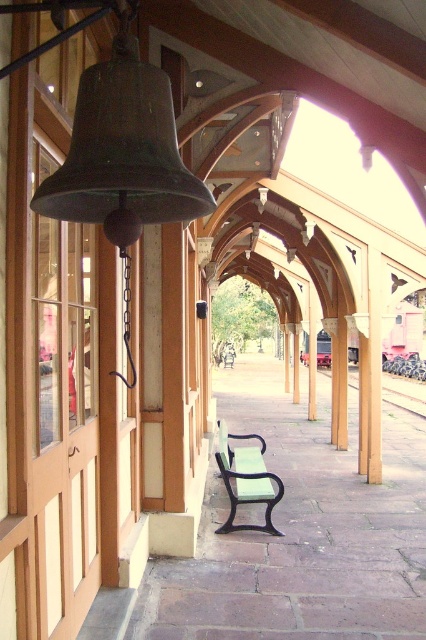
Question: Is the position of green matte bench at center less distant than that of metal train track at center?

Choices:
 (A) no
 (B) yes

Answer: (B)

Question: From the image, what is the correct spatial relationship of green matte bench at center in relation to metal train track at center?

Choices:
 (A) above
 (B) below

Answer: (A)

Question: Which point is closer to the camera?

Choices:
 (A) green matte bench at center
 (B) metal train track at center

Answer: (A)

Question: Among these points, which one is nearest to the camera?

Choices:
 (A) (354, 387)
 (B) (235, 481)

Answer: (B)

Question: Does green matte bench at center have a larger size compared to metal train track at center?

Choices:
 (A) no
 (B) yes

Answer: (A)